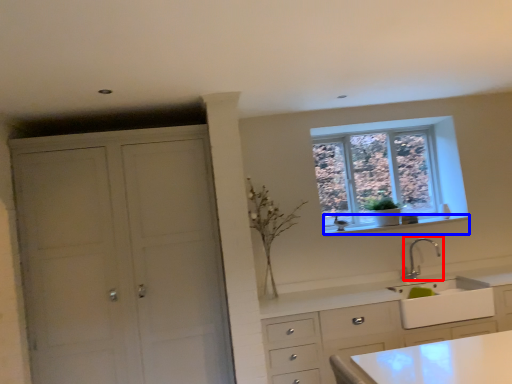
Question: Which of the following is the farthest to the observer, tap (highlighted by a red box) or window sill (highlighted by a blue box)?

Choices:
 (A) tap
 (B) window sill

Answer: (B)